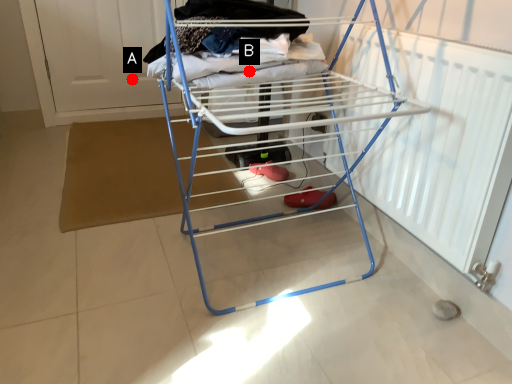
Question: Two points are circled on the image, labeled by A and B beside each circle. Among these points, which one is nearest to the camera?

Choices:
 (A) A is closer
 (B) B is closer

Answer: (B)